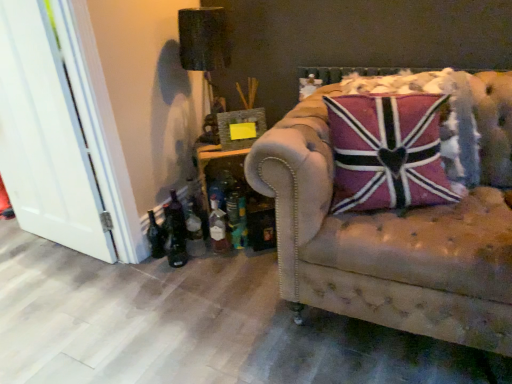
Where is `free location to the right of translucent glass bottle at lower left, the 1th bottle viewed from the right`? The height and width of the screenshot is (384, 512). free location to the right of translucent glass bottle at lower left, the 1th bottle viewed from the right is located at coordinates (254, 255).